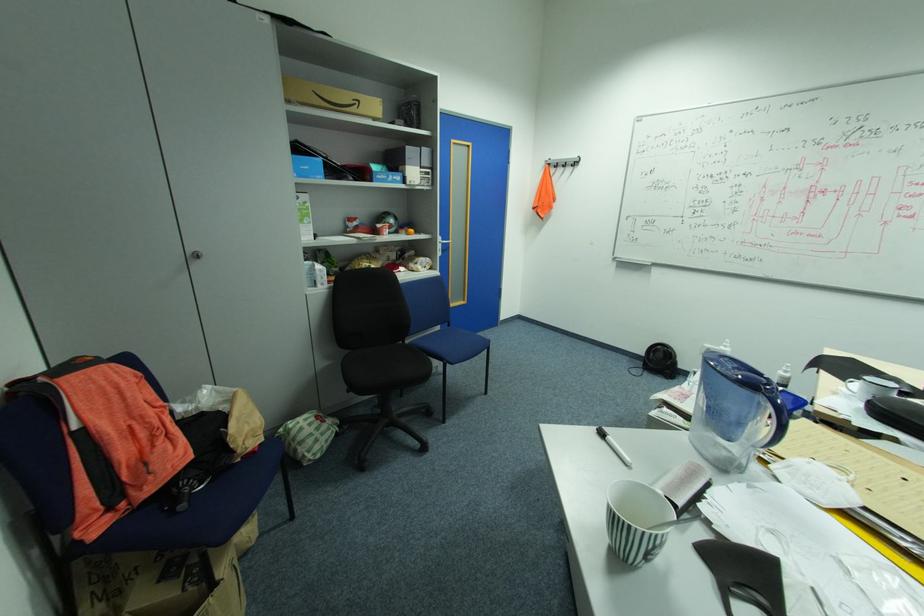
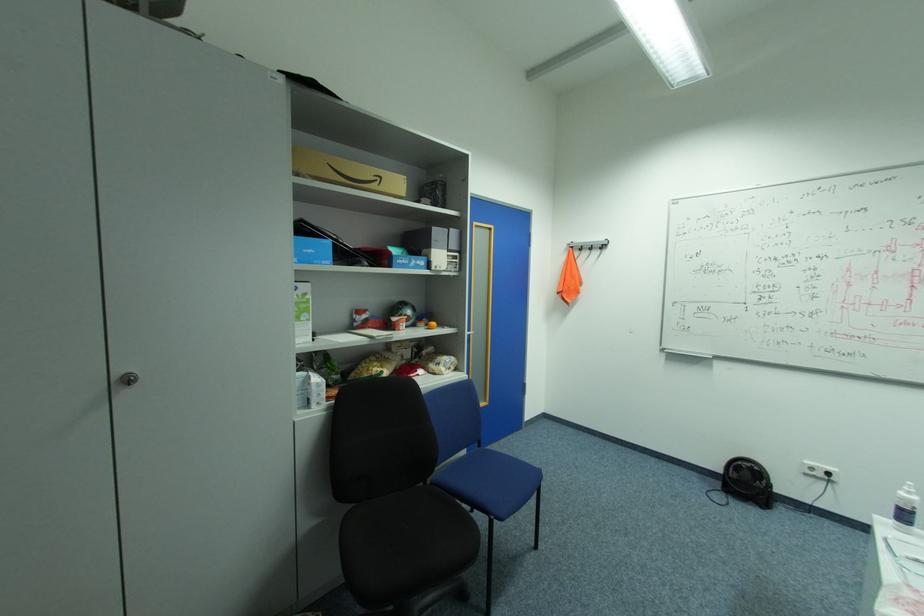
Question: I am providing you with two images of the same scene from different viewpoints. Which of the following objects are not visible in image2?

Choices:
 (A) black floor fan
 (B) small orange ball
 (C) white drink carton
 (D) none of these

Answer: (D)